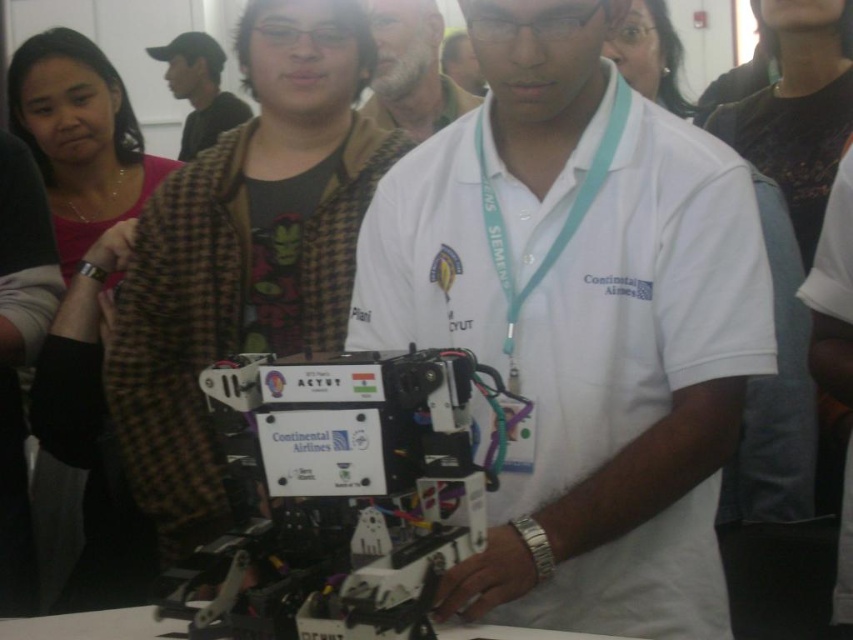
Question: Does white cotton shirt at center appear on the left side of white beard at center?

Choices:
 (A) no
 (B) yes

Answer: (A)

Question: Can you confirm if white cotton shirt at center is smaller than brown checkered jacket at upper left?

Choices:
 (A) yes
 (B) no

Answer: (A)

Question: Estimate the real-world distances between objects in this image. Which object is farther from the brown checkered lab coat at center?

Choices:
 (A) white beard at center
 (B) white cotton shirt at center
 (C) brown checkered jacket at upper left

Answer: (C)

Question: Observing the image, what is the correct spatial positioning of white cotton shirt at center in reference to brown checkered jacket at upper left?

Choices:
 (A) below
 (B) above

Answer: (A)

Question: Which of the following is the farthest from the observer?

Choices:
 (A) (519, 60)
 (B) (399, 81)
 (C) (181, 84)
 (D) (167, 289)

Answer: (C)

Question: Which point is closer to the camera?

Choices:
 (A) (194, 100)
 (B) (496, 564)
 (C) (192, 372)
 (D) (434, 35)

Answer: (B)